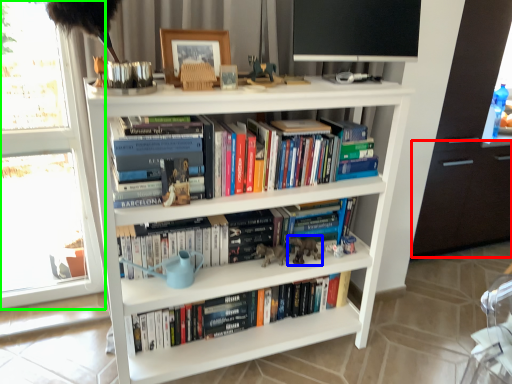
Question: Based on their relative distances, which object is farther from drawer (highlighted by a red box)? Choose from animal (highlighted by a blue box) and window frame (highlighted by a green box).

Choices:
 (A) animal
 (B) window frame

Answer: (B)